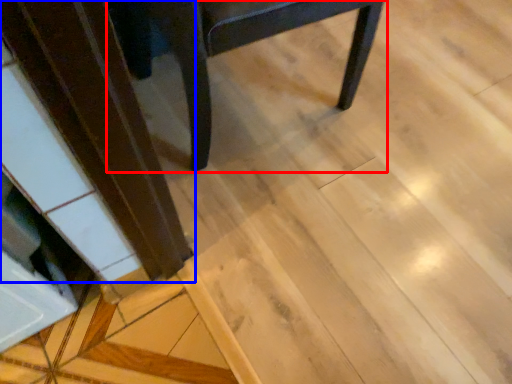
Question: Which point is closer to the camera, chair (highlighted by a red box) or wood (highlighted by a blue box)?

Choices:
 (A) chair
 (B) wood

Answer: (A)